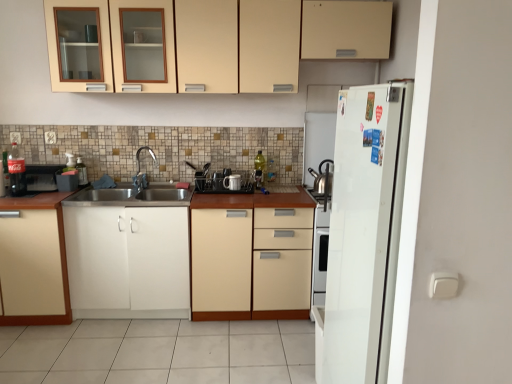
Image resolution: width=512 pixels, height=384 pixels. In order to click on white tile at lower center in this screenshot , I will do `click(159, 352)`.

The width and height of the screenshot is (512, 384). Describe the element at coordinates (16, 172) in the screenshot. I see `matte glass bottle at left, placed as the 2th bottle when sorted from right to left` at that location.

This screenshot has height=384, width=512. I want to click on white matte refrigerator at right, so click(365, 230).

This screenshot has height=384, width=512. Identify the location of matte black dish rack at center, marked as the third appliance in a right-to-left arrangement. coord(221,180).

The image size is (512, 384). In order to click on silver metallic tea pot at right in this screenshot , I will do coord(323,177).

Considering the relative sizes of beige wood cabinet at center, marked as the fourth cabinetry in a left-to-right arrangement, and white matte cabinet at lower left, the third cabinetry viewed from the right, in the image provided, is beige wood cabinet at center, marked as the fourth cabinetry in a left-to-right arrangement, bigger than white matte cabinet at lower left, the third cabinetry viewed from the right,?

Correct, beige wood cabinet at center, marked as the fourth cabinetry in a left-to-right arrangement, is larger in size than white matte cabinet at lower left, the third cabinetry viewed from the right.

Can we say beige wood cabinet at center, the first cabinetry positioned from the right, lies outside white matte cabinet at lower left, acting as the 2th cabinetry starting from the left?

That's correct, beige wood cabinet at center, the first cabinetry positioned from the right, is outside of white matte cabinet at lower left, acting as the 2th cabinetry starting from the left.

Which point is more forward, [217,214] or [98,223]?

The point [217,214] is in front.

Can you confirm if beige wood cabinet at center, the first cabinetry positioned from the right, is thinner than white matte cabinet at lower left, the third cabinetry viewed from the right?

Yes, beige wood cabinet at center, the first cabinetry positioned from the right, is thinner than white matte cabinet at lower left, the third cabinetry viewed from the right.

From the metallic spray bottle at left, the fourth appliance when ordered from right to left, count 3rd appliance to the right and point to it. Please provide its 2D coordinates.

[(318, 141)]

Is metallic spray bottle at left, the fourth appliance when ordered from right to left, to the right of white glossy kettle at right, which appears as the 4th appliance when viewed from the left, from the viewer's perspective?

No, metallic spray bottle at left, the fourth appliance when ordered from right to left, is not to the right of white glossy kettle at right, which appears as the 4th appliance when viewed from the left.

From the image's perspective, would you say metallic spray bottle at left, arranged as the first appliance when viewed from the left, is positioned over white glossy kettle at right, acting as the first appliance starting from the right?

No.

Is metallic spray bottle at left, arranged as the first appliance when viewed from the left, located outside white glossy kettle at right, which appears as the 4th appliance when viewed from the left?

Yes, metallic spray bottle at left, arranged as the first appliance when viewed from the left, is not within white glossy kettle at right, which appears as the 4th appliance when viewed from the left.

This screenshot has width=512, height=384. What are the coordinates of `tea pot lying on the right of white matte refrigerator at right` in the screenshot? It's located at (323, 177).

Between white matte refrigerator at right and silver metallic tea pot at right, which one has larger width?

With larger width is white matte refrigerator at right.

Considering the positions of points (341, 303) and (323, 161), is point (341, 303) closer to camera compared to point (323, 161)?

Yes, point (341, 303) is closer to viewer.

Considering the relative sizes of white glossy mug at center, positioned as the 3th appliance in left-to-right order, and metallic spray bottle at left, the fourth appliance when ordered from right to left, in the image provided, is white glossy mug at center, positioned as the 3th appliance in left-to-right order, wider than metallic spray bottle at left, the fourth appliance when ordered from right to left,?

Incorrect, the width of white glossy mug at center, positioned as the 3th appliance in left-to-right order, does not surpass that of metallic spray bottle at left, the fourth appliance when ordered from right to left.

Does white glossy mug at center, which is the 2th appliance in right-to-left order, have a smaller size compared to metallic spray bottle at left, arranged as the first appliance when viewed from the left?

Correct, white glossy mug at center, which is the 2th appliance in right-to-left order, occupies less space than metallic spray bottle at left, arranged as the first appliance when viewed from the left.

From a real-world perspective, is white glossy mug at center, which is the 2th appliance in right-to-left order, positioned under metallic spray bottle at left, arranged as the first appliance when viewed from the left, based on gravity?

Yes, from a real-world perspective, white glossy mug at center, which is the 2th appliance in right-to-left order, is under metallic spray bottle at left, arranged as the first appliance when viewed from the left.

Is white glossy mug at center, which is the 2th appliance in right-to-left order, facing away from metallic spray bottle at left, the fourth appliance when ordered from right to left?

No, metallic spray bottle at left, the fourth appliance when ordered from right to left, is not at the back of white glossy mug at center, which is the 2th appliance in right-to-left order.

Does beige wood cabinet at center, the first cabinetry positioned from the right, have a smaller size compared to matte cream cabinet at upper center, which is the second cabinetry in right-to-left order?

Incorrect, beige wood cabinet at center, the first cabinetry positioned from the right, is not smaller in size than matte cream cabinet at upper center, which is the second cabinetry in right-to-left order.

Which object is more forward, beige wood cabinet at center, marked as the fourth cabinetry in a left-to-right arrangement, or matte cream cabinet at upper center, which is the second cabinetry in right-to-left order?

A: matte cream cabinet at upper center, which is the second cabinetry in right-to-left order, is more forward.

In terms of width, does beige wood cabinet at center, the first cabinetry positioned from the right, look wider or thinner when compared to matte cream cabinet at upper center, which is the second cabinetry in right-to-left order?

Considering their sizes, beige wood cabinet at center, the first cabinetry positioned from the right, looks broader than matte cream cabinet at upper center, which is the second cabinetry in right-to-left order.

From the image's perspective, is brushed metal faucet at center above or below matte cream cabinet at upper center, which is the second cabinetry in right-to-left order?

brushed metal faucet at center is situated lower than matte cream cabinet at upper center, which is the second cabinetry in right-to-left order, in the image.

Which is more to the left, brushed metal faucet at center or matte cream cabinet at upper center, which is the second cabinetry in right-to-left order?

From the viewer's perspective, brushed metal faucet at center appears more on the left side.

Based on their sizes in the image, would you say brushed metal faucet at center is bigger or smaller than matte cream cabinet at upper center, which is the second cabinetry in right-to-left order?

brushed metal faucet at center is smaller than matte cream cabinet at upper center, which is the second cabinetry in right-to-left order.

Starting from the brushed metal faucet at center, which cabinetry is the 2nd one in front? Please provide its 2D coordinates.

[(206, 43)]

Find the location of a particular element. The width and height of the screenshot is (512, 384). cabinetry above the beige wood cabinet at center, marked as the fourth cabinetry in a left-to-right arrangement (from the image's perspective) is located at coordinates (206, 43).

In the scene shown: Would you say matte cream cabinet at upper center, which is the second cabinetry in right-to-left order, contains beige wood cabinet at center, marked as the fourth cabinetry in a left-to-right arrangement?

No, beige wood cabinet at center, marked as the fourth cabinetry in a left-to-right arrangement, is located outside of matte cream cabinet at upper center, which is the second cabinetry in right-to-left order.

Is matte cream cabinet at upper center, which is the second cabinetry in right-to-left order, not close to beige wood cabinet at center, the first cabinetry positioned from the right?

matte cream cabinet at upper center, which is the second cabinetry in right-to-left order, is far away from beige wood cabinet at center, the first cabinetry positioned from the right.

Which is farther from the camera, (250, 38) or (261, 258)?

The point (261, 258) is farther from the camera.

Which cabinetry is the 2nd one when counting from the front of the beige wood cabinet at center, the first cabinetry positioned from the right? Please provide its 2D coordinates.

[(128, 261)]

At what (x,y) coordinates should I click in order to perform the action: click on the 3rd appliance to the right when counting from the metallic spray bottle at left, arranged as the first appliance when viewed from the left. Please return your answer as a coordinate pair (x, y). Looking at the image, I should click on (318, 141).

When comparing their distances from white matte refrigerator at right, does translucent glass bottle at center, which is counted as the 1th bottle, starting from the back, or silver metallic tea pot at right seem further?

translucent glass bottle at center, which is counted as the 1th bottle, starting from the back, lies further to white matte refrigerator at right than the other object.

Which object lies further to the anchor point matte black dish rack at center, marked as the third appliance in a right-to-left arrangement, white matte refrigerator at right or beige wood cabinet at center, marked as the fourth cabinetry in a left-to-right arrangement?

white matte refrigerator at right is positioned further to the anchor matte black dish rack at center, marked as the third appliance in a right-to-left arrangement.

Based on their spatial positions, is matte black dish rack at center, marked as the third appliance in a right-to-left arrangement, or metallic spray bottle at left, arranged as the first appliance when viewed from the left, closer to white glossy kettle at right, which appears as the 4th appliance when viewed from the left?

matte black dish rack at center, marked as the third appliance in a right-to-left arrangement, lies closer to white glossy kettle at right, which appears as the 4th appliance when viewed from the left, than the other object.

When comparing their distances from beige wood cabinet at center, the first cabinetry positioned from the right, does white matte cabinet at lower left, the third cabinetry viewed from the right, or matte cream cabinet at upper center, which is the second cabinetry in right-to-left order, seem closer?

white matte cabinet at lower left, the third cabinetry viewed from the right, is closer to beige wood cabinet at center, the first cabinetry positioned from the right.

Estimate the real-world distances between objects in this image. Which object is further from translucent glass bottle at center, which is counted as the 1th bottle, starting from the back, white matte refrigerator at right or brushed metal faucet at center?

white matte refrigerator at right lies further to translucent glass bottle at center, which is counted as the 1th bottle, starting from the back, than the other object.

Estimate the real-world distances between objects in this image. Which object is closer to matte white cabinet at lower left, arranged as the 4th cabinetry when viewed from the right, brushed metal faucet at center or matte black dish rack at center, marked as the third appliance in a right-to-left arrangement?

Among the two, brushed metal faucet at center is located nearer to matte white cabinet at lower left, arranged as the 4th cabinetry when viewed from the right.

Looking at the image, which one is located closer to matte black dish rack at center, which is the 2th appliance from left to right, matte cream cabinet at upper center, the third cabinetry from the left, or brushed metal faucet at center?

brushed metal faucet at center is positioned closer to the anchor matte black dish rack at center, which is the 2th appliance from left to right.

Which object lies further to the anchor point white glossy mug at center, positioned as the 3th appliance in left-to-right order, brushed metal faucet at center or beige wood cabinet at center, the first cabinetry positioned from the right?

beige wood cabinet at center, the first cabinetry positioned from the right, lies further to white glossy mug at center, positioned as the 3th appliance in left-to-right order, than the other object.

Find the location of a particular element. faucet between white plastic electric outlet at upper left, the second electric outlet from the left, and beige wood cabinet at center, the first cabinetry positioned from the right is located at coordinates (140, 169).

Where is `tea pot located between white matte refrigerator at right and white glossy kettle at right, acting as the first appliance starting from the right, in the depth direction`? The image size is (512, 384). tea pot located between white matte refrigerator at right and white glossy kettle at right, acting as the first appliance starting from the right, in the depth direction is located at coordinates point(323,177).

At what (x,y) coordinates should I click in order to perform the action: click on tile between white plastic electric outlet at upper left, which ranks as the first electric outlet in right-to-left order, and white glossy kettle at right, acting as the first appliance starting from the right. Please return your answer as a coordinate pair (x, y). The width and height of the screenshot is (512, 384). Looking at the image, I should click on (159, 352).

Locate an element on the screen. The height and width of the screenshot is (384, 512). bottle between matte glass bottle at left, which is counted as the second bottle, starting from the back, and silver metallic tea pot at right is located at coordinates [260, 168].